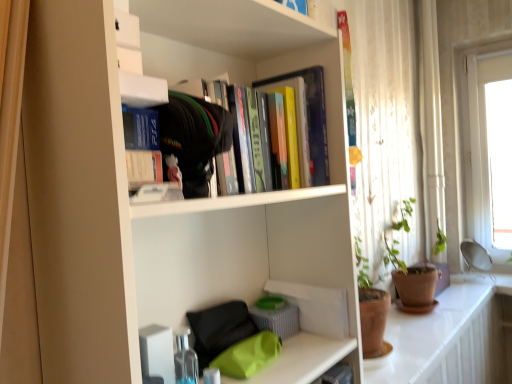
You are a GUI agent. You are given a task and a screenshot of the screen. Output one action in this format:
    pyautogui.click(x=<x>, y=<y>)
    Task: Click on the white sheer curtain at right
    The width and height of the screenshot is (512, 384).
    Given the screenshot: What is the action you would take?
    pyautogui.click(x=431, y=128)

Measure the distance between point (438, 341) and camera.

Point (438, 341) and camera are 4.45 feet apart.

At what (x,y) coordinates should I click in order to perform the action: click on matte gray basket at center. Please return your answer as a coordinate pair (x, y). Looking at the image, I should click on pyautogui.click(x=277, y=320).

Describe the element at coordinates (193, 137) in the screenshot. The width and height of the screenshot is (512, 384). I see `hardcover books at upper center, which is the second book from front to back` at that location.

This screenshot has height=384, width=512. Describe the element at coordinates (143, 168) in the screenshot. I see `white matte paperback book at upper center` at that location.

Locate an element on the screen. This screenshot has height=384, width=512. white matte bookcase at upper center is located at coordinates (154, 206).

The width and height of the screenshot is (512, 384). I want to click on white sheer curtain at right, so click(x=431, y=128).

Is white glossy counter top at lower right bigger or smaller than hardcover books at upper center, which is the second book from front to back?

Considering their sizes, white glossy counter top at lower right takes up more space than hardcover books at upper center, which is the second book from front to back.

Does white glossy counter top at lower right have a greater height compared to hardcover books at upper center, which is the second book from front to back?

In fact, white glossy counter top at lower right may be shorter than hardcover books at upper center, which is the second book from front to back.

From the image's perspective, which object appears higher, white glossy counter top at lower right or hardcover books at upper center, positioned as the first book in right-to-left order?

hardcover books at upper center, positioned as the first book in right-to-left order, is shown above in the image.

From the white glossy counter top at lower right, count 1st books forward and point to it. Please provide its 2D coordinates.

[(193, 137)]

Looking at their sizes, would you say white matte paperback book at upper center is wider or thinner than white glossy counter top at lower right?

white matte paperback book at upper center is thinner than white glossy counter top at lower right.

Considering the positions of point (133, 179) and point (415, 328), is point (133, 179) closer or farther from the camera than point (415, 328)?

Clearly, point (133, 179) is closer to the camera than point (415, 328).

From a real-world perspective, is white matte paperback book at upper center positioned under white glossy counter top at lower right based on gravity?

No, from a real-world perspective, white matte paperback book at upper center is not below white glossy counter top at lower right.

Could you tell me if matte black ps4 case at upper center, which is counted as the first book, starting from the left, is facing white matte bookcase at upper center?

Yes, matte black ps4 case at upper center, which is counted as the first book, starting from the left, is turned towards white matte bookcase at upper center.

Between matte black ps4 case at upper center, which is counted as the 2th book, starting from the back, and white matte bookcase at upper center, which one has smaller size?

With smaller size is matte black ps4 case at upper center, which is counted as the 2th book, starting from the back.

Which object is thinner, matte black ps4 case at upper center, which is counted as the 2th book, starting from the back, or white matte bookcase at upper center?

Thinner between the two is matte black ps4 case at upper center, which is counted as the 2th book, starting from the back.

How many degrees apart are the facing directions of matte black ps4 case at upper center, which appears as the 2th book when viewed from the right, and white matte bookcase at upper center?

matte black ps4 case at upper center, which appears as the 2th book when viewed from the right, and white matte bookcase at upper center are facing 3.02 degrees away from each other.

In the scene shown: From the image's perspective, is matte black ps4 case at upper center, which is counted as the first book, starting from the front, over white glossy counter top at lower right?

Indeed, from the image's perspective, matte black ps4 case at upper center, which is counted as the first book, starting from the front, is shown above white glossy counter top at lower right.

Based on the photo, which point is more forward, (155,127) or (450,329)?

Point (155,127)

How different are the orientations of matte black ps4 case at upper center, which is counted as the first book, starting from the front, and white glossy counter top at lower right in degrees?

The angular difference between matte black ps4 case at upper center, which is counted as the first book, starting from the front, and white glossy counter top at lower right is 92.7 degrees.

Considering the positions of objects matte black ps4 case at upper center, which appears as the 2th book when viewed from the right, and white glossy counter top at lower right in the image provided, who is more to the left, matte black ps4 case at upper center, which appears as the 2th book when viewed from the right, or white glossy counter top at lower right?

matte black ps4 case at upper center, which appears as the 2th book when viewed from the right.

From the image's perspective, is white matte paperback book at upper center positioned above or below hardcover books at upper center, positioned as the first book in right-to-left order?

white matte paperback book at upper center is below hardcover books at upper center, positioned as the first book in right-to-left order.

Is hardcover books at upper center, arranged as the 1th book when viewed from the back, completely or partially inside white matte paperback book at upper center?

That's incorrect, hardcover books at upper center, arranged as the 1th book when viewed from the back, is not inside white matte paperback book at upper center.

From the picture: Considering the relative sizes of white matte paperback book at upper center and hardcover books at upper center, positioned as the first book in right-to-left order, in the image provided, is white matte paperback book at upper center thinner than hardcover books at upper center, positioned as the first book in right-to-left order,?

Yes, white matte paperback book at upper center is thinner than hardcover books at upper center, positioned as the first book in right-to-left order.

Where is `paperback book lying in front of the hardcover books at upper center, positioned as the first book in right-to-left order`? paperback book lying in front of the hardcover books at upper center, positioned as the first book in right-to-left order is located at coordinates (143, 168).

Does white matte paperback book at upper center turn towards white matte bookcase at upper center?

Yes, white matte paperback book at upper center is aimed at white matte bookcase at upper center.

Does white matte paperback book at upper center touch white matte bookcase at upper center?

No, white matte paperback book at upper center is not making contact with white matte bookcase at upper center.

Do you think white matte paperback book at upper center is within white matte bookcase at upper center, or outside of it?

white matte paperback book at upper center is enclosed within white matte bookcase at upper center.

From the image's perspective, is white matte paperback book at upper center positioned above or below white matte bookcase at upper center?

Based on their image positions, white matte paperback book at upper center is located above white matte bookcase at upper center.

Consider the image. From a real-world perspective, is hardcover books at upper center, positioned as the first book in right-to-left order, on white glossy counter top at lower right?

Yes, from a real-world perspective, hardcover books at upper center, positioned as the first book in right-to-left order, is over white glossy counter top at lower right

Is hardcover books at upper center, arranged as the 2th book when viewed from the left, touching white glossy counter top at lower right?

No, hardcover books at upper center, arranged as the 2th book when viewed from the left, is not next to white glossy counter top at lower right.

Is point (182, 93) in front of point (484, 377)?

Yes, point (182, 93) is closer to viewer.

You are a GUI agent. You are given a task and a screenshot of the screen. Output one action in this format:
    pyautogui.click(x=<x>, y=<y>)
    Task: Click on the 1st book counting from the left of the white glossy counter top at lower right
    This screenshot has height=384, width=512.
    Given the screenshot: What is the action you would take?
    pyautogui.click(x=193, y=137)

At what (x,y) coordinates should I click in order to perform the action: click on counter top located underneath the white matte paperback book at upper center (from a real-world perspective). Please return your answer as a coordinate pair (x, y). Looking at the image, I should click on (442, 339).

Based on their spatial positions, is matte black ps4 case at upper center, which is counted as the first book, starting from the front, or hardcover books at upper center, arranged as the 2th book when viewed from the left, further from matte plastic toy at upper center?

Based on the image, hardcover books at upper center, arranged as the 2th book when viewed from the left, appears to be further to matte plastic toy at upper center.

When comparing their distances from matte plastic toy at upper center, does white glossy counter top at lower right or white matte bookcase at upper center seem closer?

white matte bookcase at upper center is positioned closer to the anchor matte plastic toy at upper center.

From the image, which object appears to be nearer to matte gray basket at center, matte black ps4 case at upper center, which is counted as the first book, starting from the front, or white matte bookcase at upper center?

white matte bookcase at upper center.

Based on their spatial positions, is matte black ps4 case at upper center, which is counted as the first book, starting from the left, or white matte bookcase at upper center closer to white glossy counter top at lower right?

The object closer to white glossy counter top at lower right is white matte bookcase at upper center.

Considering their positions, is matte gray basket at center positioned closer to white matte bookcase at upper center than white sheer curtain at right?

Among the two, matte gray basket at center is located nearer to white matte bookcase at upper center.

Estimate the real-world distances between objects in this image. Which object is closer to white sheer curtain at right, hardcover books at upper center, arranged as the 2th book when viewed from the left, or white matte paperback book at upper center?

hardcover books at upper center, arranged as the 2th book when viewed from the left, is closer to white sheer curtain at right.

Looking at the image, which one is located closer to hardcover books at upper center, arranged as the 2th book when viewed from the left, matte black ps4 case at upper center, which is counted as the first book, starting from the front, or white glossy counter top at lower right?

matte black ps4 case at upper center, which is counted as the first book, starting from the front, lies closer to hardcover books at upper center, arranged as the 2th book when viewed from the left, than the other object.

Considering their positions, is matte gray basket at center positioned further to white sheer curtain at right than white matte paperback book at upper center?

Among the two, white matte paperback book at upper center is located further to white sheer curtain at right.

Find the location of a particular element. basket between white matte paperback book at upper center and white sheer curtain at right in the front-back direction is located at coordinates (277, 320).

Identify the location of basket between matte black ps4 case at upper center, which is counted as the first book, starting from the left, and white sheer curtain at right from front to back. (277, 320).

Identify the location of basket located between hardcover books at upper center, arranged as the 1th book when viewed from the back, and white sheer curtain at right in the depth direction. The image size is (512, 384). pyautogui.click(x=277, y=320).

The height and width of the screenshot is (384, 512). Identify the location of bookcase between matte plastic toy at upper center and white glossy counter top at lower right. (x=154, y=206).